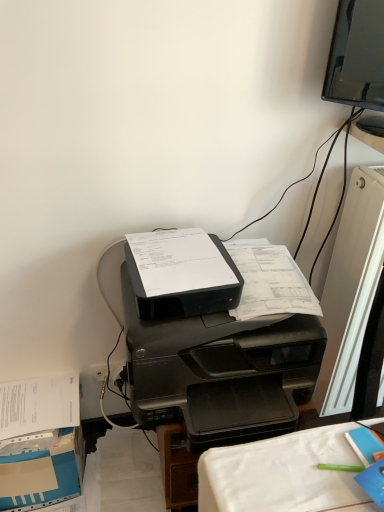
The width and height of the screenshot is (384, 512). I want to click on black plastic printer at center, so click(x=223, y=346).

Can you confirm if blue cardboard box at lower left is taller than white plastic radiator at right?

Incorrect, the height of blue cardboard box at lower left is not larger of that of white plastic radiator at right.

Between point (71, 472) and point (341, 369), which one is positioned behind?

The point (341, 369) is farther.

Looking at the image, does blue cardboard box at lower left seem bigger or smaller compared to white plastic radiator at right?

Clearly, blue cardboard box at lower left is smaller in size than white plastic radiator at right.

Does blue cardboard box at lower left turn towards white plastic radiator at right?

No, blue cardboard box at lower left is not oriented towards white plastic radiator at right.

From the picture: From a real-world perspective, who is located lower, white plastic radiator at right or black plastic printer at center?

black plastic printer at center is physically lower.

Visually, is white plastic radiator at right positioned to the left or to the right of black plastic printer at center?

Clearly, white plastic radiator at right is on the right of black plastic printer at center in the image.

Considering the sizes of objects white plastic radiator at right and black plastic printer at center in the image provided, who is smaller, white plastic radiator at right or black plastic printer at center?

Smaller between the two is white plastic radiator at right.

Is white plastic radiator at right positioned with its back to black plastic printer at center?

That's not correct — white plastic radiator at right is not looking away from black plastic printer at center.

Between point (9, 473) and point (269, 395), which one is positioned behind?

The point (9, 473) is behind.

From the image's perspective, is blue cardboard box at lower left located beneath black plastic printer at center?

Indeed, from the image's perspective, blue cardboard box at lower left is shown beneath black plastic printer at center.

Is the depth of blue cardboard box at lower left less than that of black plastic printer at center?

No.

Is blue cardboard box at lower left surrounding black plastic printer at center?

Actually, black plastic printer at center is outside blue cardboard box at lower left.

From the picture: Do you think white plastic radiator at right is within blue cardboard box at lower left, or outside of it?

white plastic radiator at right is not inside blue cardboard box at lower left, it's outside.

Looking at their sizes, would you say white plastic radiator at right is wider or thinner than blue cardboard box at lower left?

In the image, white plastic radiator at right appears to be more narrow than blue cardboard box at lower left.

From the image's perspective, is white plastic radiator at right on top of blue cardboard box at lower left?

Yes.

What's the angular difference between white plastic radiator at right and blue cardboard box at lower left's facing directions?

They differ by 0.83 degrees in their facing directions.

Is black plastic printer at center in front of blue cardboard box at lower left?

Yes, black plastic printer at center is closer to the viewer.

Is black plastic printer at center next to blue cardboard box at lower left?

black plastic printer at center is not next to blue cardboard box at lower left, and they're not touching.

Considering the positions of point (245, 389) and point (78, 486), is point (245, 389) closer or farther from the camera than point (78, 486)?

Point (245, 389).

Does black plastic printer at center have a greater width compared to white plastic radiator at right?

Indeed, black plastic printer at center has a greater width compared to white plastic radiator at right.

In order to click on printer below the white plastic radiator at right (from the image's perspective) in this screenshot , I will do `click(223, 346)`.

Is black plastic printer at center shorter than white plastic radiator at right?

Indeed, black plastic printer at center has a lesser height compared to white plastic radiator at right.

Is black plastic printer at center placed right next to white plastic radiator at right?

No.

Locate an element on the screen. This screenshot has height=512, width=384. cardboard box on the left of the white plastic radiator at right is located at coordinates (41, 469).

Where is `printer below the white plastic radiator at right (from a real-world perspective)`? This screenshot has width=384, height=512. printer below the white plastic radiator at right (from a real-world perspective) is located at coordinates (223, 346).

Estimate the real-world distances between objects in this image. Which object is closer to black plastic printer at center, white plastic radiator at right or blue cardboard box at lower left?

white plastic radiator at right.

Looking at the image, which one is located further to white plastic radiator at right, black plastic printer at center or blue cardboard box at lower left?

blue cardboard box at lower left lies further to white plastic radiator at right than the other object.

Based on their spatial positions, is blue cardboard box at lower left or black plastic printer at center further from white plastic radiator at right?

blue cardboard box at lower left lies further to white plastic radiator at right than the other object.

Considering their positions, is black plastic printer at center positioned further to blue cardboard box at lower left than white plastic radiator at right?

white plastic radiator at right.

Based on their spatial positions, is white plastic radiator at right or black plastic printer at center further from blue cardboard box at lower left?

Based on the image, white plastic radiator at right appears to be further to blue cardboard box at lower left.

Which object lies nearer to the anchor point black plastic printer at center, blue cardboard box at lower left or white plastic radiator at right?

Based on the image, white plastic radiator at right appears to be nearer to black plastic printer at center.

Find the location of a particular element. The height and width of the screenshot is (512, 384). printer between blue cardboard box at lower left and white plastic radiator at right from left to right is located at coordinates (223, 346).